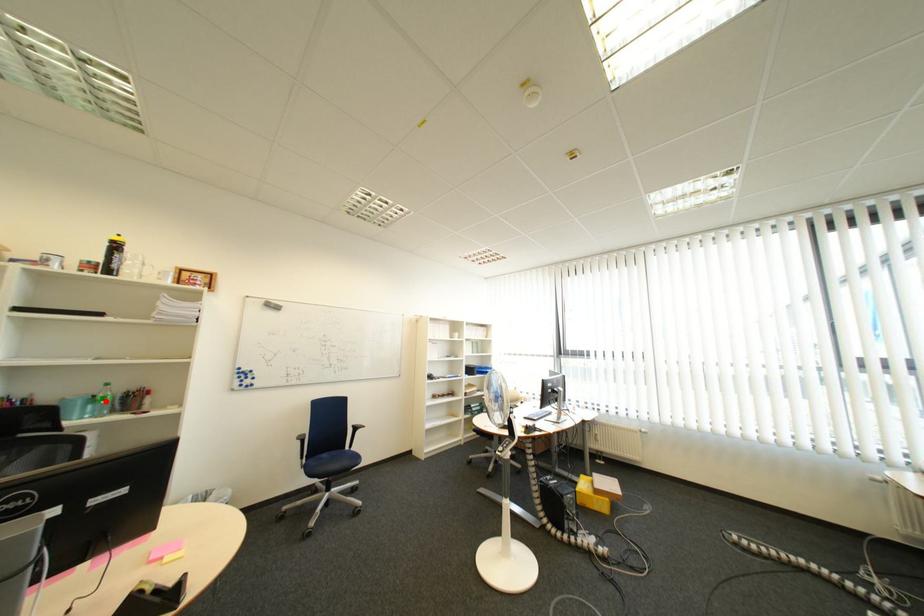
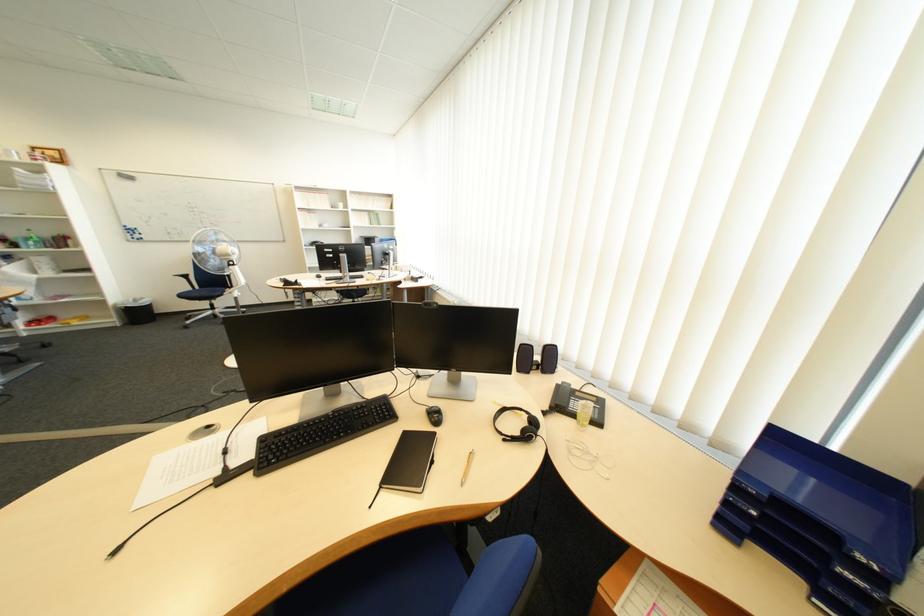
Question: I am providing you with two images of the same scene from different viewpoints. Image1 has a red point marked. In image2, the corresponding 3D location appears at what relative position? Reply with the corresponding letter.

Choices:
 (A) Closer
 (B) Farther

Answer: (B)